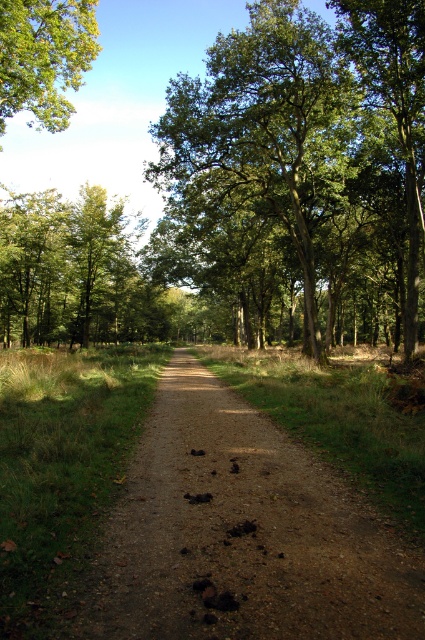
Question: Considering the real-world distances, which object is closest to the green leafy tree at center?

Choices:
 (A) green leafy tree at upper left
 (B) green leafy tree at upper right

Answer: (B)

Question: Is brown gravel path at center closer to the viewer compared to green leafy tree at upper left?

Choices:
 (A) yes
 (B) no

Answer: (A)

Question: Where is brown gravel path at center located in relation to green leafy tree at upper left in the image?

Choices:
 (A) right
 (B) left

Answer: (A)

Question: Which object is farther from the camera taking this photo?

Choices:
 (A) green leafy tree at upper left
 (B) green leafy tree at upper right
 (C) brown gravel path at center

Answer: (B)

Question: Which object is positioned closest to the green leafy tree at upper left?

Choices:
 (A) green leafy tree at upper right
 (B) green leafy tree at center
 (C) brown gravel path at center

Answer: (C)

Question: Does brown gravel path at center appear under green leafy tree at upper left?

Choices:
 (A) no
 (B) yes

Answer: (B)